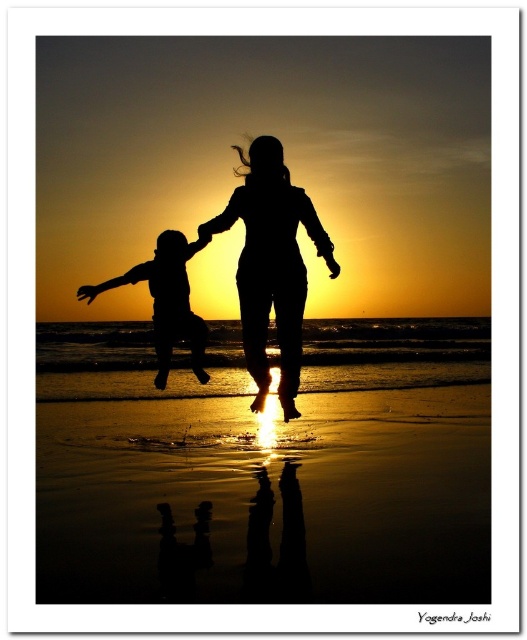
You are a photographer capturing the sunset scene. You notice the silhouette figure at center and the matte black figure at left. Which figure is closer to the camera based on their positions?

The silhouette figure at center is closer to the camera because it is in front of the matte black figure at left.

You are a photographer trying to capture the reflection of the shiny sand beach at lower center and the matte black figure at left in the sunset scene. Which object should you focus on to ensure the reflection is clearly visible?

The shiny sand beach at lower center is positioned under the matte black figure at left, so focusing on the shiny sand beach at lower center will ensure the reflection is clearly visible because it is the reflective surface below the figure.

You are a photographer trying to capture the sunset scene. You notice the silhouette figure at center and the matte black figure at left. Which figure would appear more slender in your photo?

The silhouette figure at center is thinner than the matte black figure at left, so it would appear more slender in the photo.